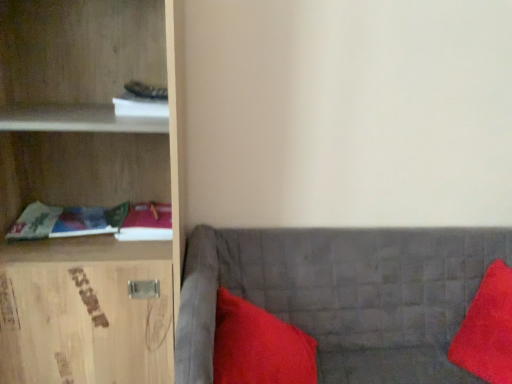
Question: In terms of height, does satin red pillow at lower right, acting as the first pillow starting from the left, look taller or shorter compared to matte fabric book at left, the first book in the bottom-to-top sequence?

Choices:
 (A) tall
 (B) short

Answer: (A)

Question: Is satin red pillow at lower right, acting as the first pillow starting from the left, inside the boundaries of matte fabric book at left, the first book in the bottom-to-top sequence, or outside?

Choices:
 (A) inside
 (B) outside

Answer: (B)

Question: Which of these objects is positioned farthest from the light wood cabinet at left?

Choices:
 (A) matte red book at left, the 2th book from the top
 (B) velvet red pillow at right, placed as the 1th pillow when sorted from right to left
 (C) satin red pillow at lower right, acting as the first pillow starting from the left
 (D) white paper at upper left, positioned as the third book in bottom-to-top order
 (E) velvet grey couch at lower right

Answer: (B)

Question: Estimate the real-world distances between objects in this image. Which object is farther from the velvet red pillow at right, placed as the 1th pillow when sorted from right to left?

Choices:
 (A) white paper at upper left, positioned as the third book in bottom-to-top order
 (B) velvet grey couch at lower right
 (C) matte fabric book at left, the first book in the bottom-to-top sequence
 (D) light wood cabinet at left
 (E) matte red book at left, the 2th book from the top

Answer: (A)